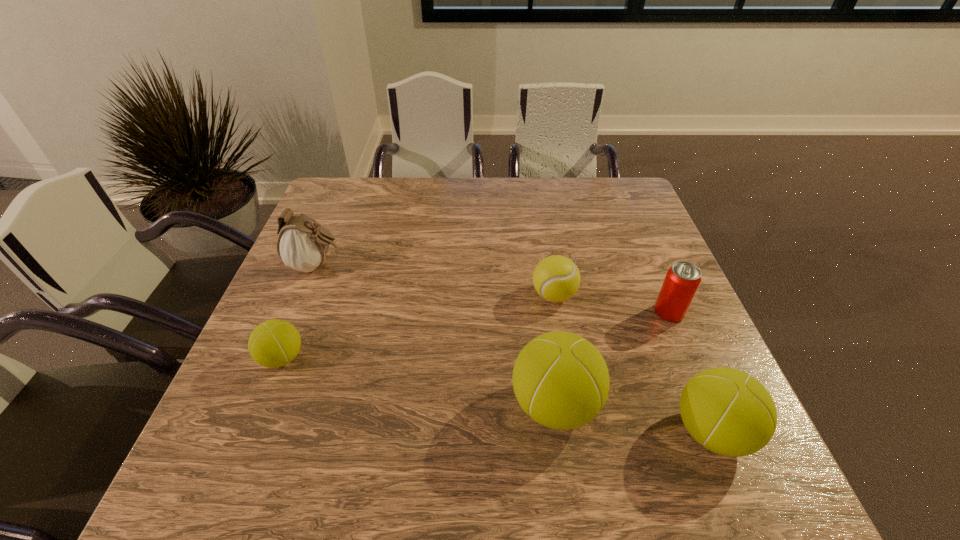
Locate an element on the screen. This screenshot has height=540, width=960. free location that satisfies the following two spatial constraints: 1. on the front side of the farthest tennis ball; 2. on the left side of the can is located at coordinates (557, 312).

Image resolution: width=960 pixels, height=540 pixels. Find the location of `free location that satisfies the following two spatial constraints: 1. on the front side of the farthest tennis ball; 2. on the right side of the second tallest tennis ball`. free location that satisfies the following two spatial constraints: 1. on the front side of the farthest tennis ball; 2. on the right side of the second tallest tennis ball is located at coordinates (577, 432).

In order to click on vacant space that satisfies the following two spatial constraints: 1. on the back side of the second tallest tennis ball; 2. on the right side of the can in this screenshot , I will do `click(662, 312)`.

Identify the location of free space that satisfies the following two spatial constraints: 1. on the front-facing side of the farthest tennis ball; 2. on the right side of the pouch. (304, 295).

The width and height of the screenshot is (960, 540). Find the location of `vacant region that satisfies the following two spatial constraints: 1. on the front-facing side of the pouch; 2. on the back side of the third shortest tennis ball`. vacant region that satisfies the following two spatial constraints: 1. on the front-facing side of the pouch; 2. on the back side of the third shortest tennis ball is located at coordinates (249, 432).

Where is `vacant space that satisfies the following two spatial constraints: 1. on the front-facing side of the pouch; 2. on the left side of the can`? vacant space that satisfies the following two spatial constraints: 1. on the front-facing side of the pouch; 2. on the left side of the can is located at coordinates (298, 312).